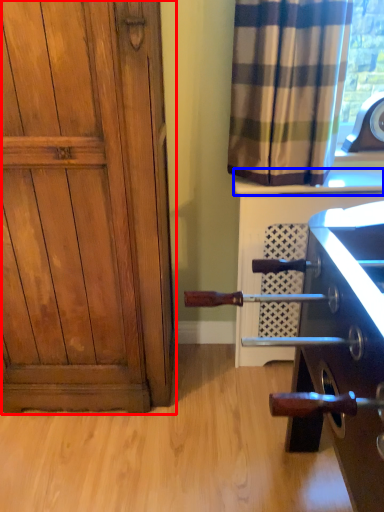
Question: Which point is further to the camera, door (highlighted by a red box) or window sill (highlighted by a blue box)?

Choices:
 (A) door
 (B) window sill

Answer: (B)